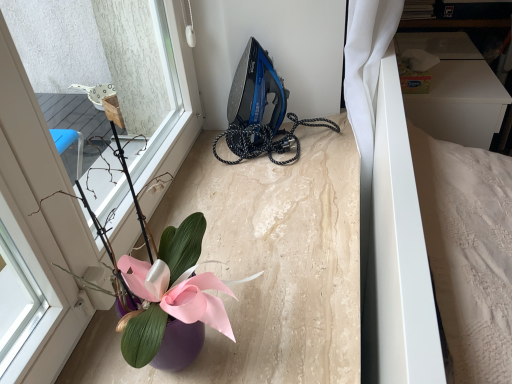
Question: Is white matte bed at right wider than purple glossy vase at lower left?

Choices:
 (A) yes
 (B) no

Answer: (A)

Question: Considering the relative positions of white matte bed at right and purple glossy vase at lower left in the image provided, is white matte bed at right in front of purple glossy vase at lower left?

Choices:
 (A) yes
 (B) no

Answer: (B)

Question: Is white matte bed at right at the left side of purple glossy vase at lower left?

Choices:
 (A) no
 (B) yes

Answer: (A)

Question: Are white matte bed at right and purple glossy vase at lower left beside each other?

Choices:
 (A) no
 (B) yes

Answer: (A)

Question: Is there a large distance between white matte bed at right and purple glossy vase at lower left?

Choices:
 (A) no
 (B) yes

Answer: (A)

Question: In the image, is blue glossy iron at upper center on the left side or the right side of purple glossy vase at lower left?

Choices:
 (A) left
 (B) right

Answer: (B)

Question: Relative to purple glossy vase at lower left, is blue glossy iron at upper center in front or behind?

Choices:
 (A) behind
 (B) front

Answer: (A)

Question: Is blue glossy iron at upper center wider or thinner than purple glossy vase at lower left?

Choices:
 (A) thin
 (B) wide

Answer: (B)

Question: Is blue glossy iron at upper center taller or shorter than purple glossy vase at lower left?

Choices:
 (A) tall
 (B) short

Answer: (B)

Question: In terms of width, does purple glossy vase at lower left look wider or thinner when compared to blue glossy iron at upper center?

Choices:
 (A) wide
 (B) thin

Answer: (B)

Question: Considering the positions of point (112, 254) and point (226, 115), is point (112, 254) closer or farther from the camera than point (226, 115)?

Choices:
 (A) farther
 (B) closer

Answer: (B)

Question: Considering the positions of purple glossy vase at lower left and blue glossy iron at upper center in the image, is purple glossy vase at lower left bigger or smaller than blue glossy iron at upper center?

Choices:
 (A) big
 (B) small

Answer: (A)

Question: From the image's perspective, is purple glossy vase at lower left above or below blue glossy iron at upper center?

Choices:
 (A) below
 (B) above

Answer: (A)

Question: Considering the positions of purple glossy vase at lower left and white matte bed at right in the image, is purple glossy vase at lower left wider or thinner than white matte bed at right?

Choices:
 (A) wide
 (B) thin

Answer: (B)

Question: Considering the positions of point (168, 327) and point (377, 306), is point (168, 327) closer or farther from the camera than point (377, 306)?

Choices:
 (A) closer
 (B) farther

Answer: (A)